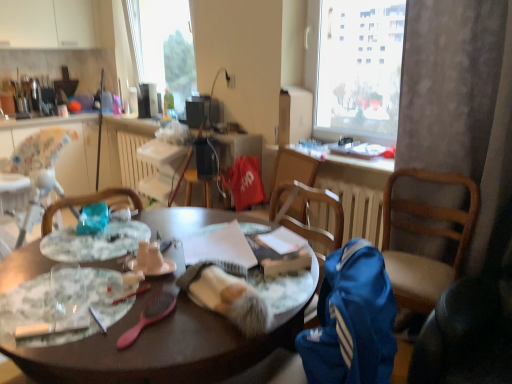
Question: Is matte white coffee cup at center wider or thinner than matte plastic power outlet at upper center?

Choices:
 (A) wide
 (B) thin

Answer: (A)

Question: In the image, is matte white coffee cup at center on the left side or the right side of matte plastic power outlet at upper center?

Choices:
 (A) left
 (B) right

Answer: (A)

Question: Estimate the real-world distances between objects in this image. Which object is closer to the white plastic radiator at center?

Choices:
 (A) matte white coffee cup at center
 (B) transparent glass window at upper center
 (C) translucent plastic bottle at upper center
 (D) wooden table at center
 (E) matte black lamp at upper center

Answer: (C)

Question: Which object is the closest to the wooden table at center?

Choices:
 (A) blue fabric chair at right
 (B) matte plastic power outlet at upper center
 (C) satin black speaker at center
 (D) white plastic radiator at center
 (E) marble-patterned plate at center-left, the first plate when ordered from front to back

Answer: (E)